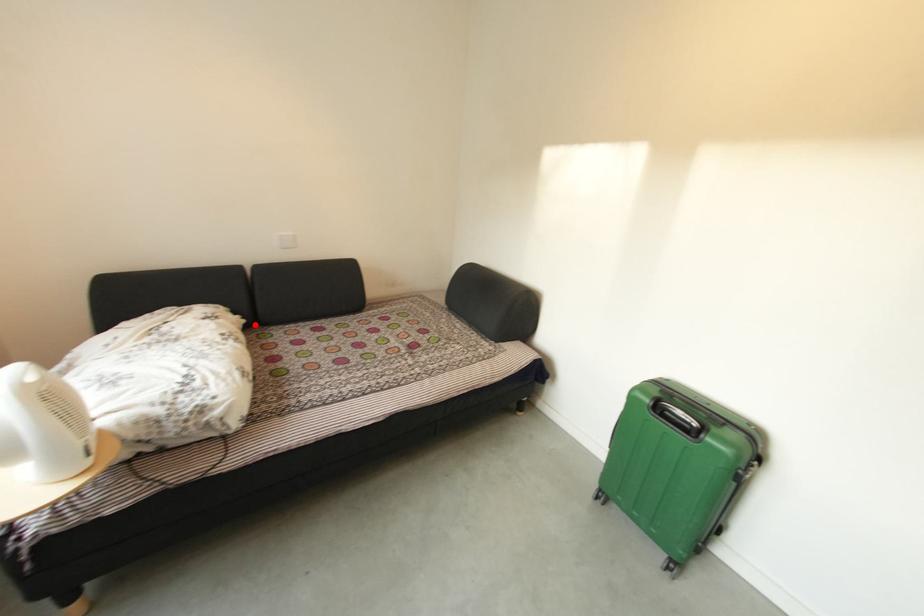
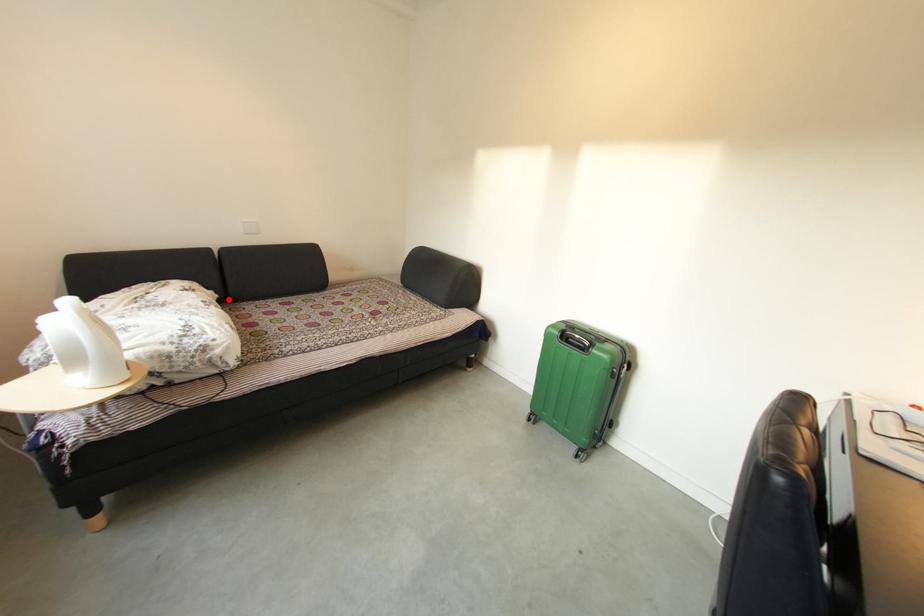
I am providing you with two images of the same scene from different viewpoints. A red point is marked on the first image and another point is marked on the second image. Are the points marked in image1 and image2 representing the same 3D position?

Yes